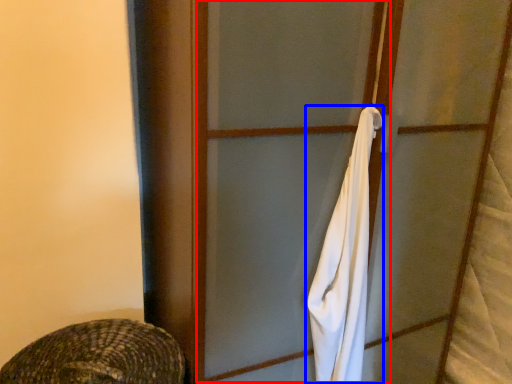
Question: Which object appears farthest to the camera in this image, screen door (highlighted by a red box) or towel/napkin (highlighted by a blue box)?

Choices:
 (A) screen door
 (B) towel/napkin

Answer: (B)